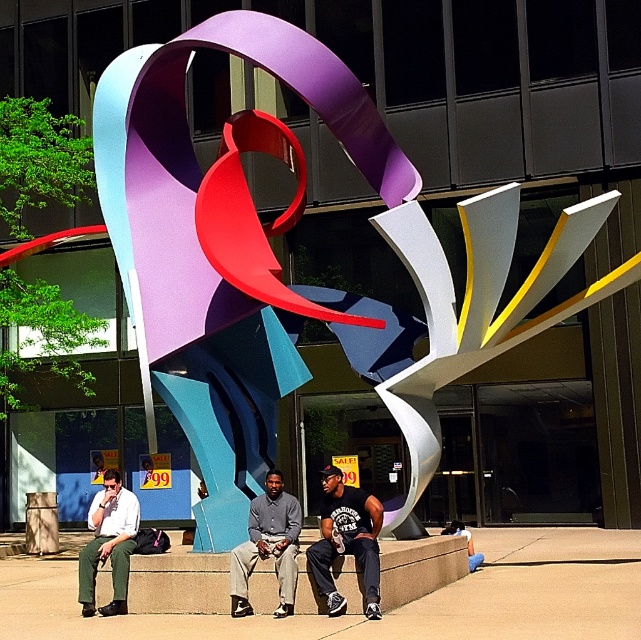
Which is more to the left, matte metallic abstract sculpture at center or gray shirt at center?

From the viewer's perspective, gray shirt at center appears more on the left side.

How much distance is there between matte metallic abstract sculpture at center and gray shirt at center?

matte metallic abstract sculpture at center and gray shirt at center are 4.53 feet apart from each other.

Does point (504, 218) come in front of point (276, 552)?

That is False.

Locate an element on the screen. matte metallic abstract sculpture at center is located at coordinates (279, 266).

Who is higher up, matte metallic abstract sculpture at center or matte white shirt at left?

matte metallic abstract sculpture at center is higher up.

Is matte metallic abstract sculpture at center closer to camera compared to matte white shirt at left?

Yes, it is in front of matte white shirt at left.

The height and width of the screenshot is (640, 641). I want to click on matte metallic abstract sculpture at center, so click(279, 266).

From the picture: Which is above, matte metallic abstract sculpture at center or dark blue jeans at center?

matte metallic abstract sculpture at center is higher up.

At what (x,y) coordinates should I click in order to perform the action: click on matte metallic abstract sculpture at center. Please return your answer as a coordinate pair (x, y). The image size is (641, 640). Looking at the image, I should click on (279, 266).